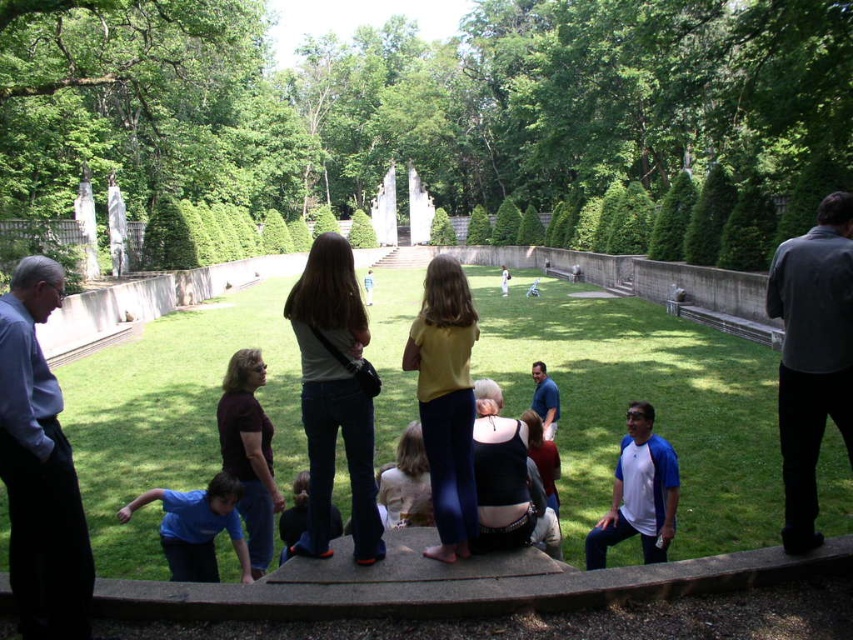
Between point (836, 280) and point (296, 483), which one is positioned behind?

Positioned behind is point (296, 483).

Which is behind, point (822, 339) or point (299, 474)?

Point (299, 474)

Locate an element on the screen. dark gray shirt at right is located at coordinates (811, 356).

Does light blue shirt at left lie in front of dark gray shirt at right?

Yes, light blue shirt at left is closer to the viewer.

Measure the distance between point (9, 388) and camera.

They are 114.94 feet apart.

Does point (49, 576) lie in front of point (839, 410)?

Yes, point (49, 576) is closer to viewer.

At what (x,y) coordinates should I click in order to perform the action: click on light blue shirt at left. Please return your answer as a coordinate pair (x, y). This screenshot has width=853, height=640. Looking at the image, I should click on (39, 467).

Is light blue shirt at left positioned at the back of blue shirt at center?

No, light blue shirt at left is in front of blue shirt at center.

Is light blue shirt at left closer to the viewer compared to blue shirt at center?

That is True.

Who is more forward, (79, 561) or (543, 412)?

Point (79, 561) is more forward.

This screenshot has width=853, height=640. In order to click on light blue shirt at left in this screenshot , I will do `click(39, 467)`.